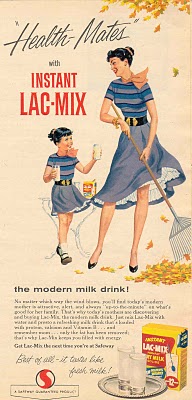
The width and height of the screenshot is (192, 400). I want to click on glass, so click(98, 153).